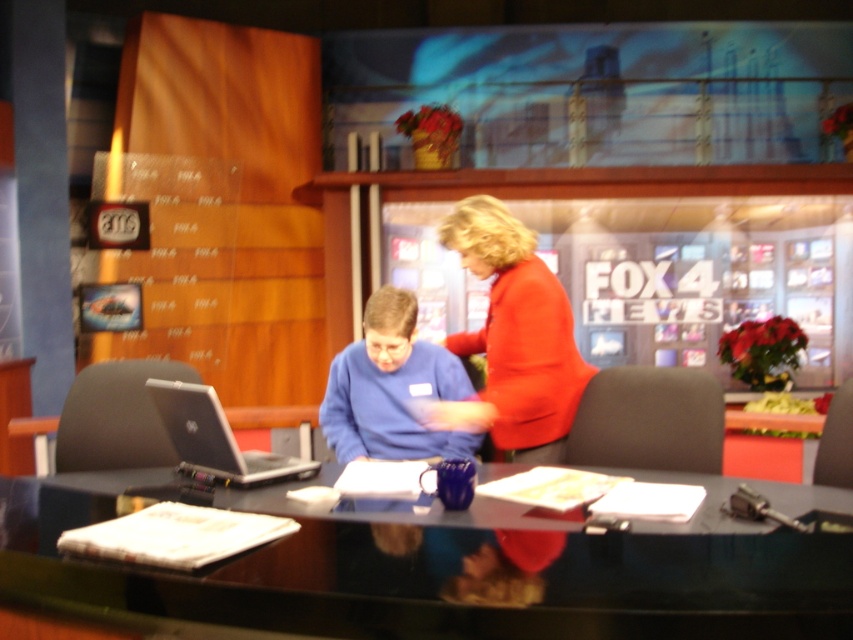
Looking at this image, you are a costume designer preparing for a TV show and need to choose between the matte red sweater at center and the blue matte sweater at center based on their sizes. Which sweater is taller?

The matte red sweater at center is taller than the blue matte sweater at center.

Looking at this image, you are a camera operator in the Fox 4 News studio. You need to focus on the shiny black desk at center and the matte red sweater at center. Which object should you adjust your camera to focus on first if you want to start with the closer one?

The shiny black desk at center is closer to the viewer than the matte red sweater at center, so you should focus on the shiny black desk at center first.

You are a camera operator in the Fox 4 News studio. You need to focus on the blue matte sweater at center and the silver metallic laptop at center. Which object should you adjust your camera to focus on first if you want to capture both in a single shot without moving the camera?

The blue matte sweater at center is located above the silver metallic laptop at center, so you should focus on the silver metallic laptop at center first since it is closer to the camera, allowing the sweater to be in focus as well.